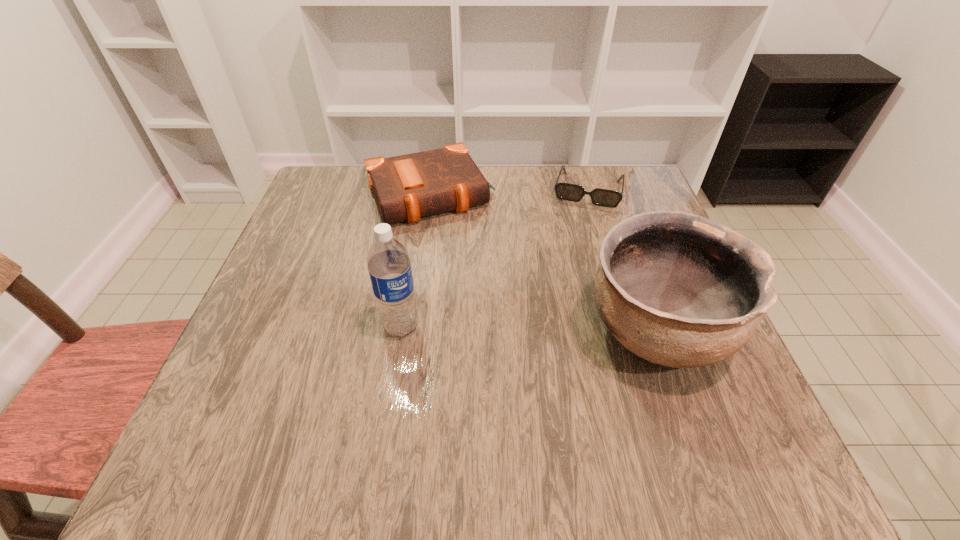
Locate an element on the screen. free spot located 0.060m on the spine side of the third tallest object is located at coordinates (457, 245).

Locate an element on the screen. The height and width of the screenshot is (540, 960). blank space located 0.080m on the spine side of the third tallest object is located at coordinates (460, 250).

I want to click on sunglasses at the far edge, so click(571, 192).

This screenshot has height=540, width=960. Find the location of `Bible that is at the far edge`. Bible that is at the far edge is located at coordinates click(x=407, y=187).

What are the coordinates of `object that is at the near edge` in the screenshot? It's located at (677, 289).

You are a GUI agent. You are given a task and a screenshot of the screen. Output one action in this format:
    pyautogui.click(x=<x>, y=<y>)
    Task: Click on the object that is positioned at the left edge
    
    Given the screenshot: What is the action you would take?
    pyautogui.click(x=407, y=187)

You are a GUI agent. You are given a task and a screenshot of the screen. Output one action in this format:
    pyautogui.click(x=<x>, y=<y>)
    Task: Click on the pottery located in the right edge section of the desktop
    Image resolution: width=960 pixels, height=540 pixels.
    Given the screenshot: What is the action you would take?
    pyautogui.click(x=677, y=289)

Find the location of a particular element. Image resolution: width=960 pixels, height=540 pixels. sunglasses that is at the right edge is located at coordinates (571, 192).

Find the location of a particular element. The image size is (960, 540). object that is at the far left corner is located at coordinates (407, 187).

Image resolution: width=960 pixels, height=540 pixels. Identify the location of object positioned at the far right corner. (571, 192).